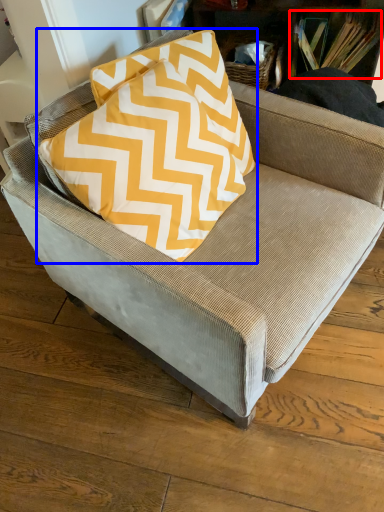
Question: Which object appears closest to the camera in this image, book (highlighted by a red box) or pillow (highlighted by a blue box)?

Choices:
 (A) book
 (B) pillow

Answer: (B)